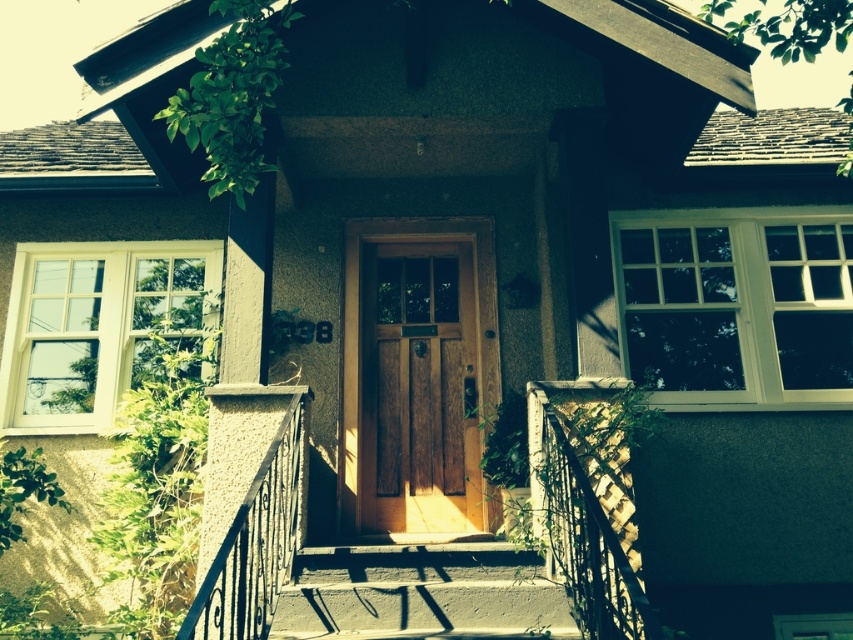
Where is `wooden door at center`? This screenshot has height=640, width=853. wooden door at center is located at coordinates (419, 388).

Locate an element on the screen. wooden door at center is located at coordinates (419, 388).

Between concrete/steps at center and wooden porch at center, which one is positioned higher?

wooden porch at center is above.

Who is shorter, concrete/steps at center or wooden porch at center?

Standing shorter between the two is concrete/steps at center.

Which is behind, point (399, 632) or point (618, 528)?

The point (618, 528) is behind.

The height and width of the screenshot is (640, 853). I want to click on concrete/steps at center, so click(421, 593).

Can you confirm if wooden door at center is positioned to the right of black wrought iron railing at center?

Indeed, wooden door at center is positioned on the right side of black wrought iron railing at center.

Between point (424, 444) and point (274, 500), which one is positioned in front?

Positioned in front is point (274, 500).

This screenshot has height=640, width=853. Identify the location of wooden door at center. (419, 388).

The height and width of the screenshot is (640, 853). I want to click on wooden door at center, so click(x=419, y=388).